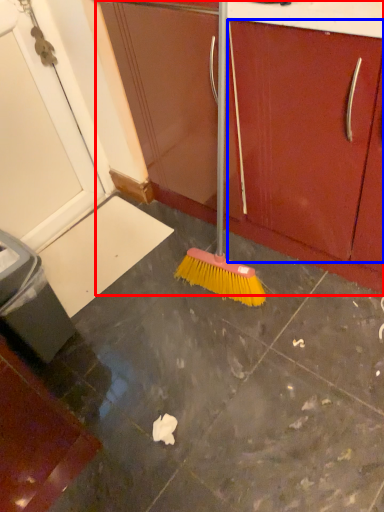
Question: Which of the following is the closest to the observer, cabinetry (highlighted by a red box) or drawer (highlighted by a blue box)?

Choices:
 (A) cabinetry
 (B) drawer

Answer: (B)